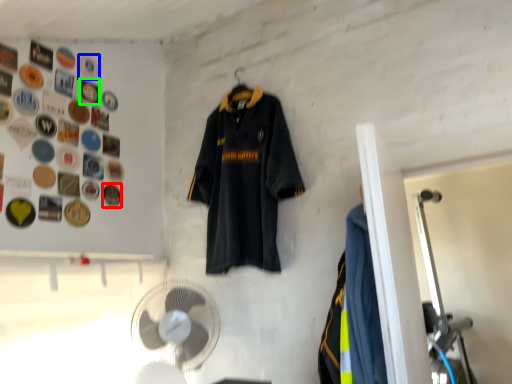
Question: Based on their relative distances, which object is farther from button (highlighted by a red box)? Choose from button (highlighted by a blue box) and button (highlighted by a green box).

Choices:
 (A) button
 (B) button

Answer: (A)